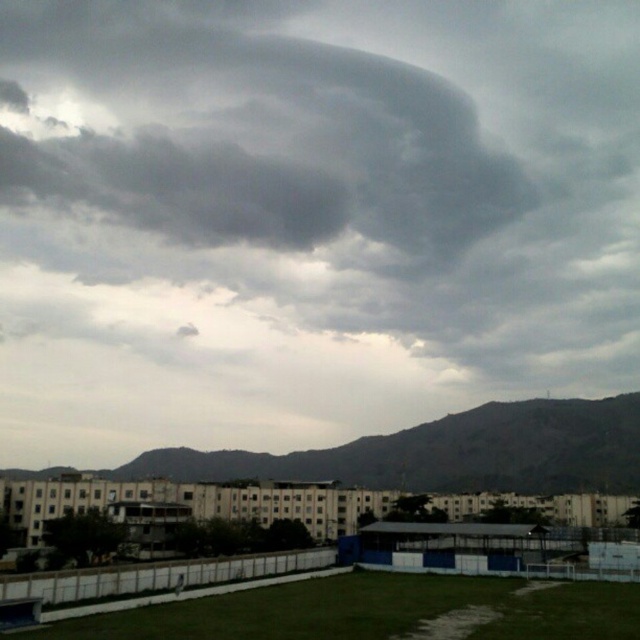
Question: Does dark gray cloud at upper center have a greater width compared to gray rocky mountain at lower center?

Choices:
 (A) yes
 (B) no

Answer: (A)

Question: Can you confirm if dark gray cloud at upper center is positioned to the right of gray rocky mountain at lower center?

Choices:
 (A) no
 (B) yes

Answer: (A)

Question: Does dark gray cloud at upper center have a greater width compared to gray rocky mountain at lower center?

Choices:
 (A) no
 (B) yes

Answer: (B)

Question: Among these objects, which one is farthest from the camera?

Choices:
 (A) dark gray cloud at upper center
 (B) gray rocky mountain at lower center

Answer: (A)